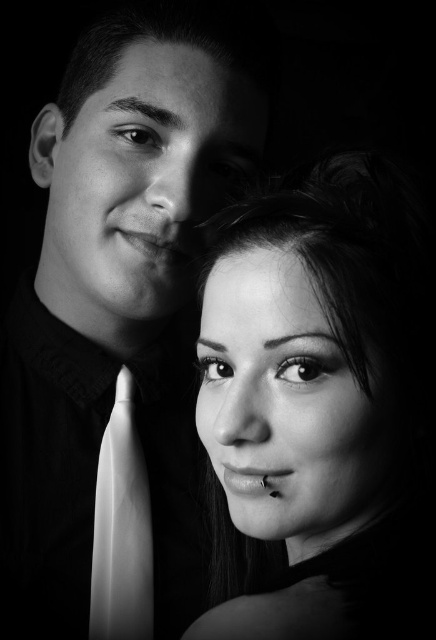
Which is more to the left, smooth skin face at center or white silk tie at left?

Positioned to the left is white silk tie at left.

Is smooth skin face at center bigger than white silk tie at left?

Yes.

The image size is (436, 640). What are the coordinates of `smooth skin face at center` in the screenshot? It's located at (316, 403).